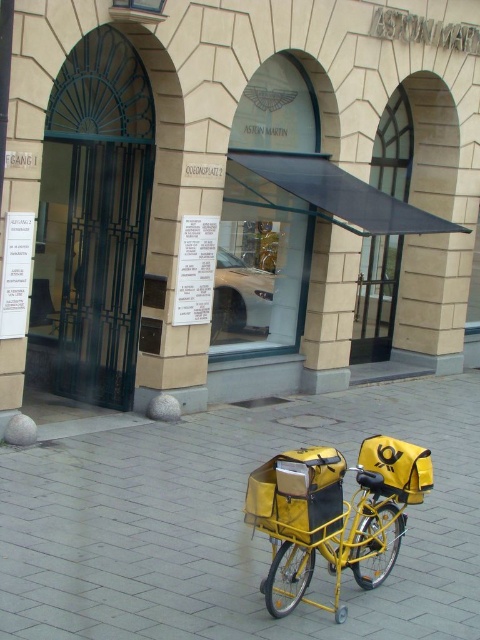
Question: Where is yellow matte pavement at lower center located in relation to yellow matte bicycle at center in the image?

Choices:
 (A) below
 (B) above

Answer: (A)

Question: Can you confirm if yellow matte pavement at lower center is thinner than yellow matte bicycle at center?

Choices:
 (A) no
 (B) yes

Answer: (B)

Question: Which point is closer to the camera?

Choices:
 (A) yellow matte bicycle at center
 (B) yellow matte pavement at lower center

Answer: (A)

Question: Which object is farther from the camera taking this photo?

Choices:
 (A) yellow matte pavement at lower center
 (B) yellow matte bicycle at center

Answer: (A)

Question: Is yellow matte pavement at lower center wider than yellow matte bicycle at center?

Choices:
 (A) no
 (B) yes

Answer: (A)

Question: Which point appears closest to the camera in this image?

Choices:
 (A) (297, 541)
 (B) (44, 461)

Answer: (A)